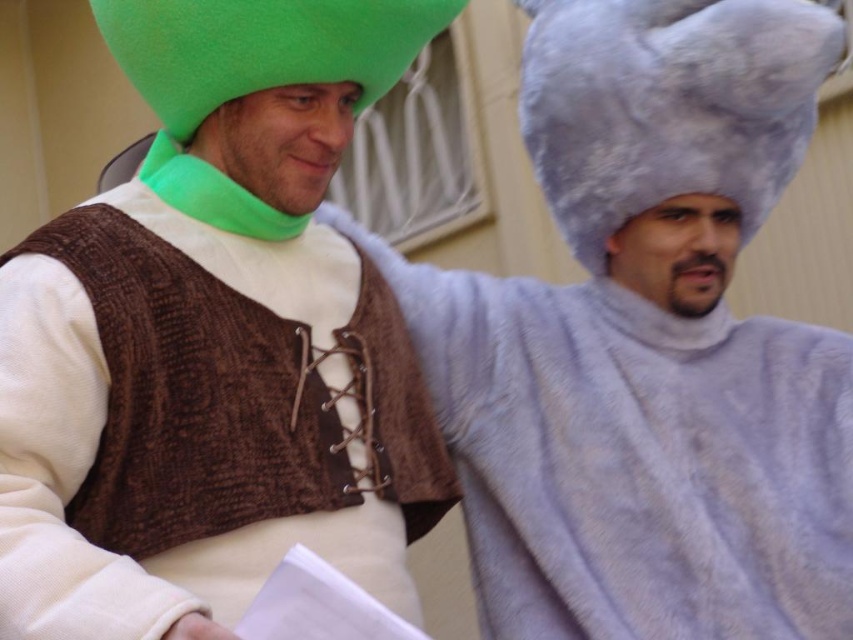
You are at a costume party and need to find the fuzzy gray hat at right. Which direction should you look from the matte green hat at upper left?

The matte green hat at upper left is to the left of the fuzzy gray hat at right, so you should look to the right from the matte green hat at upper left to find the fuzzy gray hat at right.

You are a photographer trying to capture a candid shot of the two costumed individuals in the scene. You notice a specific point marked at coordinates (213, 340). Based on the scene description, which object does this point most likely correspond to?

The point at coordinates (213, 340) corresponds to the matte green hat at upper left.

You are a photographer trying to capture a photo of both the matte green hat at upper left and the fuzzy gray hat at right. Since you can only focus on one hat at a time, which hat should you focus on to ensure the other is still in the background?

The matte green hat at upper left is located above the fuzzy gray hat at right, so focusing on the matte green hat at upper left will keep the fuzzy gray hat at right in the background.